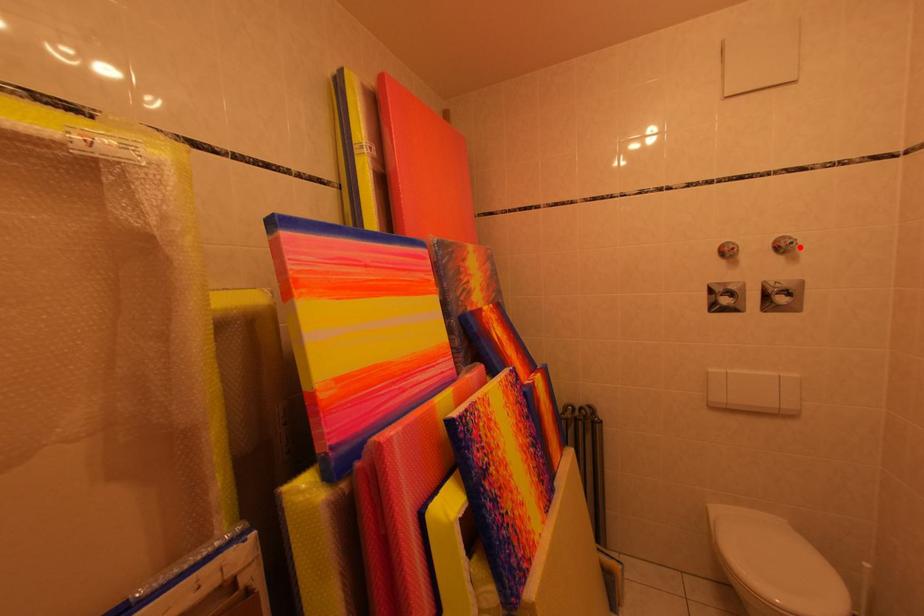
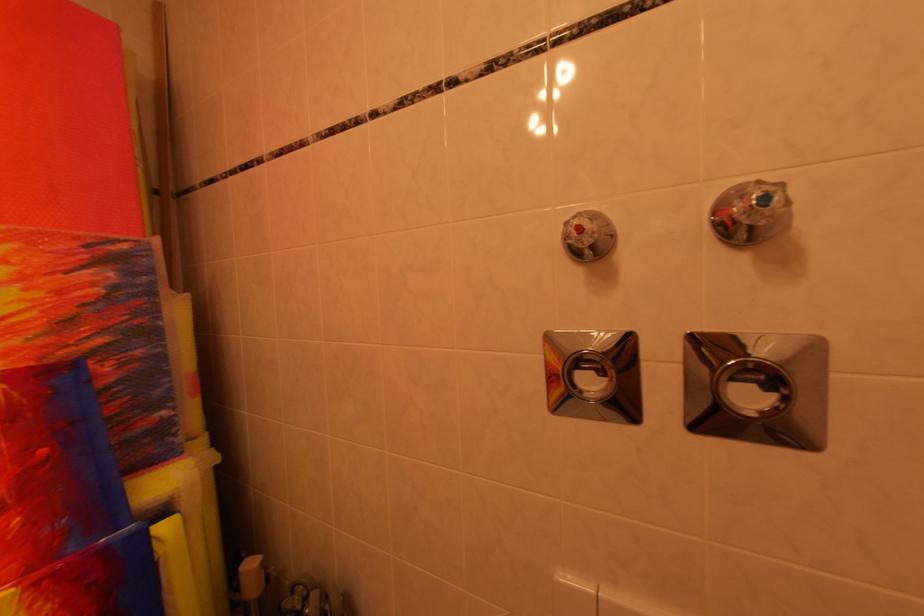
Question: I am providing you with two images of the same scene from different viewpoints. A red point is marked on the first image. Can you still see the location of the red point in image 2?

Choices:
 (A) Yes
 (B) No

Answer: (A)